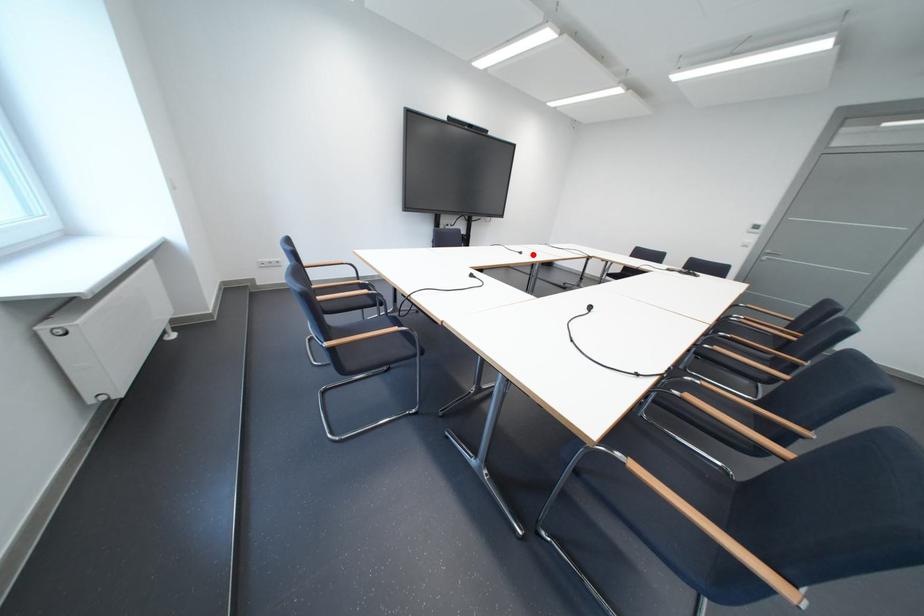
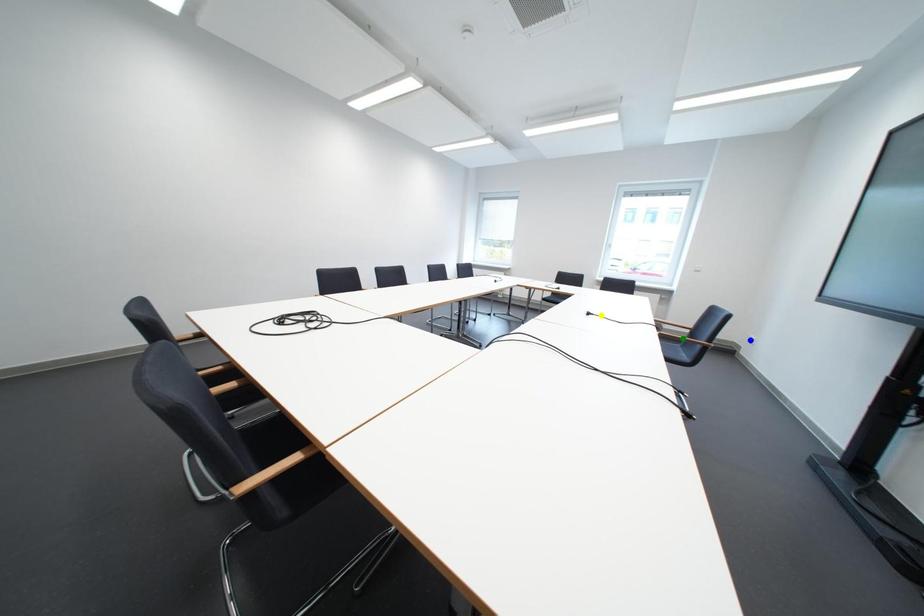
Question: I am providing you with two images of the same scene from different viewpoints. A red point is marked on the first image. You are given multiple points on the second image. In image 2, which mark is for the same physical point as the one in image 1?

Choices:
 (A) yellow point
 (B) blue point
 (C) green point

Answer: (A)